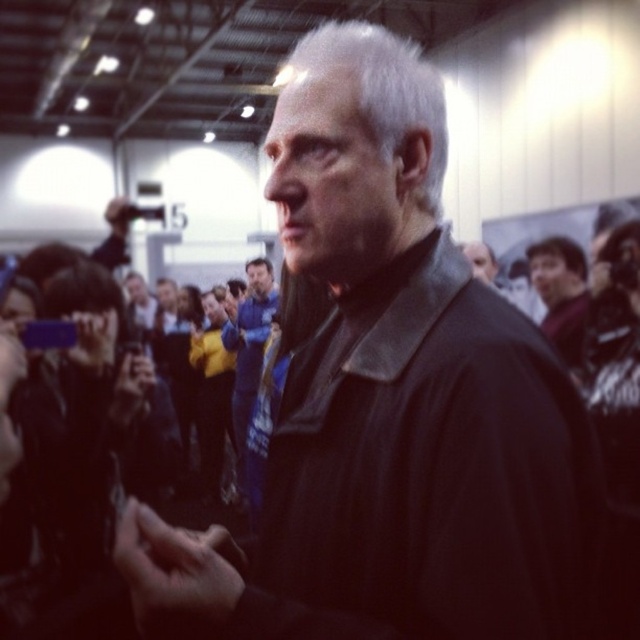
Is the position of white matte hair at center less distant than that of dark blue shirt at right?

Yes, white matte hair at center is in front of dark blue shirt at right.

Is white matte hair at center shorter than dark blue shirt at right?

Indeed, white matte hair at center has a lesser height compared to dark blue shirt at right.

Where is `white matte hair at center`? The image size is (640, 640). white matte hair at center is located at coordinates (384, 92).

Measure the distance from blue fabric shirt at center to dark blue shirt at right.

A distance of 2.27 meters exists between blue fabric shirt at center and dark blue shirt at right.

Between blue fabric shirt at center and dark blue shirt at right, which one has less height?

dark blue shirt at right is shorter.

Which is behind, point (228, 323) or point (566, 240)?

Point (566, 240)

Identify the location of blue fabric shirt at center. This screenshot has width=640, height=640. (248, 353).

In the scene shown: Can you confirm if white matte hair at center is wider than blue fabric shirt at center?

No.

From the picture: Does white matte hair at center lie in front of blue fabric shirt at center?

Result: Yes, it is in front of blue fabric shirt at center.

Identify the location of white matte hair at center. (384, 92).